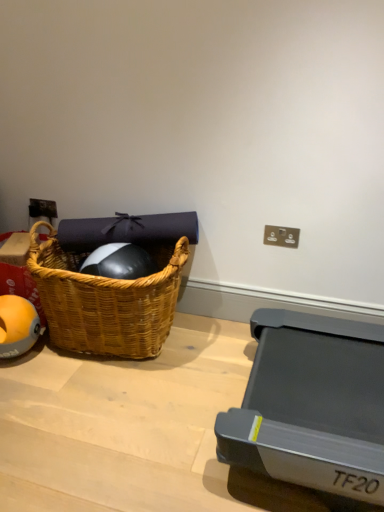
I want to click on orange rubber ball at left, so click(17, 326).

Measure the distance between point (281, 239) and camera.

A distance of 1.85 meters exists between point (281, 239) and camera.

Image resolution: width=384 pixels, height=512 pixels. In order to click on orange rubber ball at left in this screenshot , I will do `click(17, 326)`.

Which is more to the left, orange rubber ball at left or woven wood picnic basket at left?

Positioned to the left is orange rubber ball at left.

Considering the points (2, 351) and (146, 308), which point is behind, point (2, 351) or point (146, 308)?

Point (2, 351)

Looking at this image, from the image's perspective, which is above, orange rubber ball at left or woven wood picnic basket at left?

From the image's view, woven wood picnic basket at left is above.

From a real-world perspective, which is physically above, orange rubber ball at left or woven wood picnic basket at left?

In real-world perspective, woven wood picnic basket at left is above.

Between woven wood picnic basket at left and matte plastic electric outlet at upper right, which one has larger size?

With larger size is woven wood picnic basket at left.

Could you tell me if woven wood picnic basket at left is turned towards matte plastic electric outlet at upper right?

No, woven wood picnic basket at left is not turned towards matte plastic electric outlet at upper right.

Looking at their sizes, would you say woven wood picnic basket at left is wider or thinner than matte plastic electric outlet at upper right?

woven wood picnic basket at left is wider than matte plastic electric outlet at upper right.

Is point (164, 269) positioned behind point (280, 232)?

That is False.

Find the location of a particular element. The width and height of the screenshot is (384, 512). ball below the woven wood picnic basket at left (from a real-world perspective) is located at coordinates (17, 326).

In terms of size, does woven wood picnic basket at left appear bigger or smaller than orange rubber ball at left?

Considering their sizes, woven wood picnic basket at left takes up more space than orange rubber ball at left.

Is woven wood picnic basket at left beside orange rubber ball at left?

woven wood picnic basket at left and orange rubber ball at left are not in contact.

Which is in front, woven wood picnic basket at left or orange rubber ball at left?

woven wood picnic basket at left is closer to the camera.

From a real-world perspective, which object stands above the other?

matte plastic electric outlet at upper right.

Is point (269, 243) closer to viewer compared to point (35, 317)?

No.

From the picture: Can you confirm if matte plastic electric outlet at upper right is shorter than orange rubber ball at left?

Correct, matte plastic electric outlet at upper right is not as tall as orange rubber ball at left.

Is matte plastic electric outlet at upper right smaller than woven wood picnic basket at left?

Yes.

From the image's perspective, does matte plastic electric outlet at upper right appear lower than woven wood picnic basket at left?

No, from the image's perspective, matte plastic electric outlet at upper right is not beneath woven wood picnic basket at left.

This screenshot has width=384, height=512. Find the location of `picnic basket on the left of matte plastic electric outlet at upper right`. picnic basket on the left of matte plastic electric outlet at upper right is located at coordinates (107, 300).

Is matte plastic electric outlet at upper right far away from woven wood picnic basket at left?

matte plastic electric outlet at upper right is near woven wood picnic basket at left, not far away.

Can you confirm if orange rubber ball at left is thinner than matte plastic electric outlet at upper right?

No.

Can you confirm if orange rubber ball at left is shorter than matte plastic electric outlet at upper right?

In fact, orange rubber ball at left may be taller than matte plastic electric outlet at upper right.

Considering the positions of objects orange rubber ball at left and matte plastic electric outlet at upper right in the image provided, who is more to the left, orange rubber ball at left or matte plastic electric outlet at upper right?

From the viewer's perspective, orange rubber ball at left appears more on the left side.

Considering the positions of objects orange rubber ball at left and matte plastic electric outlet at upper right in the image provided, who is behind, orange rubber ball at left or matte plastic electric outlet at upper right?

matte plastic electric outlet at upper right is more distant.

Identify the location of ball that appears on the left of woven wood picnic basket at left. Image resolution: width=384 pixels, height=512 pixels. (17, 326).

Locate an element on the screen. This screenshot has height=512, width=384. picnic basket in front of the matte plastic electric outlet at upper right is located at coordinates (107, 300).

When comparing their distances from woven wood picnic basket at left, does matte plastic electric outlet at upper right or orange rubber ball at left seem closer?

orange rubber ball at left is positioned closer to the anchor woven wood picnic basket at left.

Looking at the image, which one is located further to matte plastic electric outlet at upper right, orange rubber ball at left or woven wood picnic basket at left?

orange rubber ball at left.

Looking at the image, which one is located further to matte plastic electric outlet at upper right, woven wood picnic basket at left or orange rubber ball at left?

Based on the image, orange rubber ball at left appears to be further to matte plastic electric outlet at upper right.

Estimate the real-world distances between objects in this image. Which object is further from orange rubber ball at left, woven wood picnic basket at left or matte plastic electric outlet at upper right?

Among the two, matte plastic electric outlet at upper right is located further to orange rubber ball at left.

Based on their spatial positions, is orange rubber ball at left or matte plastic electric outlet at upper right further from woven wood picnic basket at left?

matte plastic electric outlet at upper right is further to woven wood picnic basket at left.

Considering their positions, is matte plastic electric outlet at upper right positioned closer to orange rubber ball at left than woven wood picnic basket at left?

The object closer to orange rubber ball at left is woven wood picnic basket at left.

The height and width of the screenshot is (512, 384). What are the coordinates of `picnic basket situated between orange rubber ball at left and matte plastic electric outlet at upper right from left to right` in the screenshot? It's located at (107, 300).